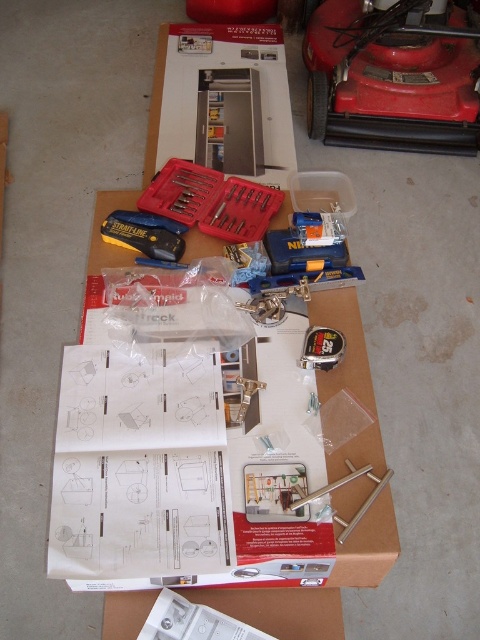
You are trying to organize your workspace. You have a brown cardboard box at center and a satin nickel cabinet handle at center. Which object should you prioritize placing first if you want to free up more space?

The brown cardboard box at center is larger in size than the satin nickel cabinet handle at center, so you should prioritize placing the brown cardboard box at center first to free up more space.

You are trying to assemble furniture and need to locate the instruction manual. You see the brown cardboard box at center and the matte black tool at center. Which object is closer to your left side?

The matte black tool at center is closer to your left side because the brown cardboard box at center is positioned on the right side of it.